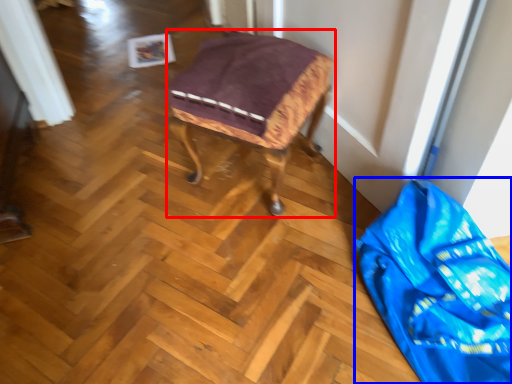
Question: Which object is further to the camera taking this photo, furniture (highlighted by a red box) or material (highlighted by a blue box)?

Choices:
 (A) furniture
 (B) material

Answer: (A)